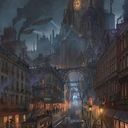
This screenshot has height=128, width=128. I want to click on archway, so click(x=67, y=72), click(x=74, y=71), click(x=83, y=73), click(x=69, y=94), click(x=72, y=87), click(x=77, y=89).